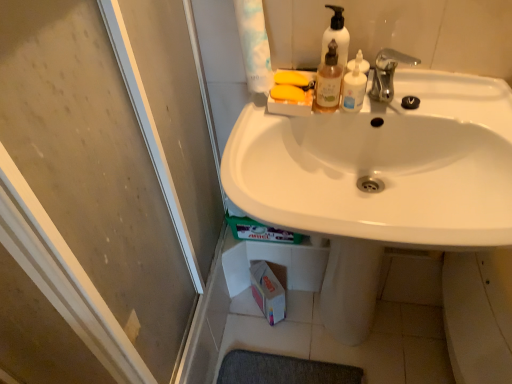
The image size is (512, 384). I want to click on vacant space to the right of translucent plastic pump bottle at upper center, so click(x=424, y=94).